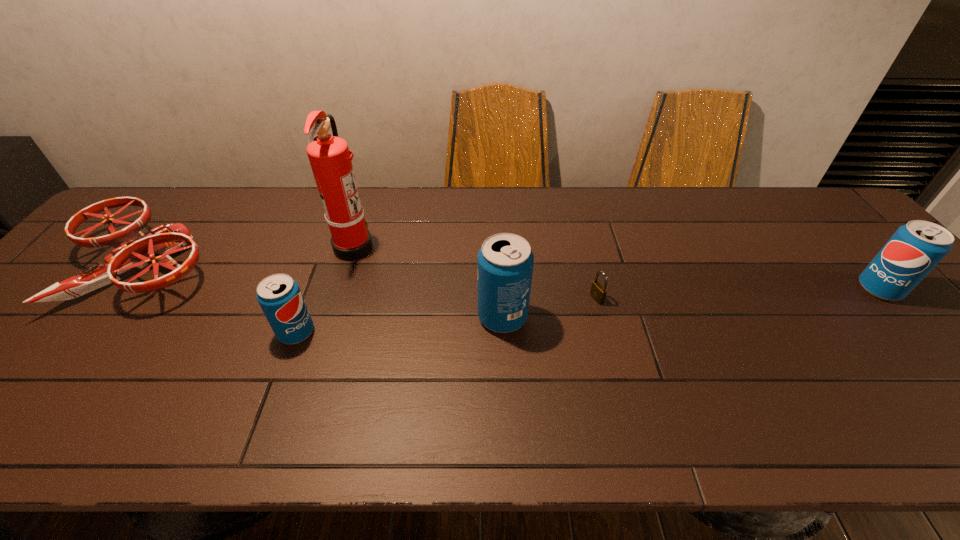
Find the location of a particular element. The width and height of the screenshot is (960, 540). the leftmost soda can is located at coordinates (279, 295).

The height and width of the screenshot is (540, 960). I want to click on the shortest soda can, so click(279, 295).

Where is `the third object from right to left`? The width and height of the screenshot is (960, 540). the third object from right to left is located at coordinates (505, 261).

Identify the location of the second shortest soda can. The width and height of the screenshot is (960, 540). (917, 247).

What are the coordinates of `the third tallest object` in the screenshot? It's located at (917, 247).

I want to click on drone, so click(x=135, y=249).

This screenshot has height=540, width=960. Find the location of `the fifth tallest object`. the fifth tallest object is located at coordinates (135, 249).

Locate an element on the screen. fire extinguisher is located at coordinates (329, 156).

What are the coordinates of `padlock` in the screenshot? It's located at (598, 292).

Locate an element on the screen. This screenshot has height=540, width=960. the second object from right to left is located at coordinates (598, 292).